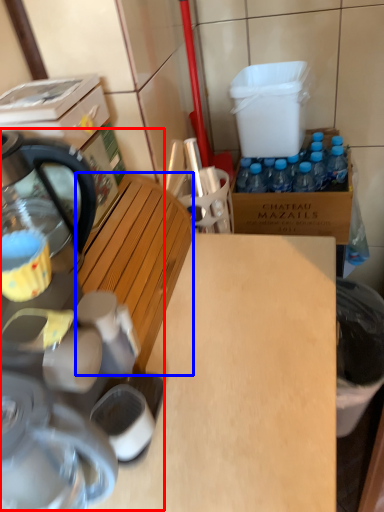
Question: Which point is further to the camera, coffee machine (highlighted by a red box) or wood (highlighted by a blue box)?

Choices:
 (A) coffee machine
 (B) wood

Answer: (B)